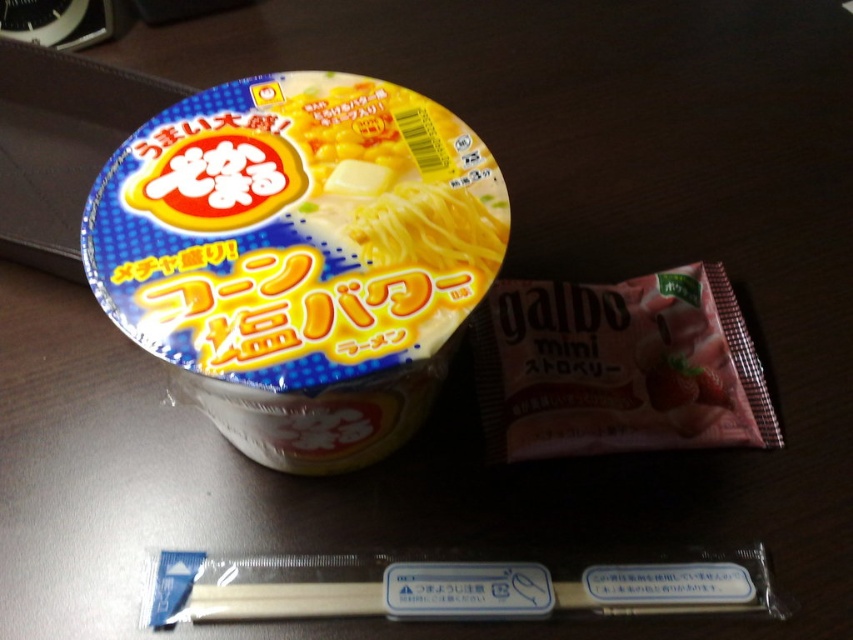
From the picture: Which is above, matte plastic cup at center or pink matte snack at right?

matte plastic cup at center

Between matte plastic cup at center and pink matte snack at right, which one is positioned lower?

pink matte snack at right is lower down.

Is point (120, 208) farther from camera compared to point (492, 380)?

No, (120, 208) is in front of (492, 380).

Image resolution: width=853 pixels, height=640 pixels. I want to click on matte plastic cup at center, so click(x=299, y=257).